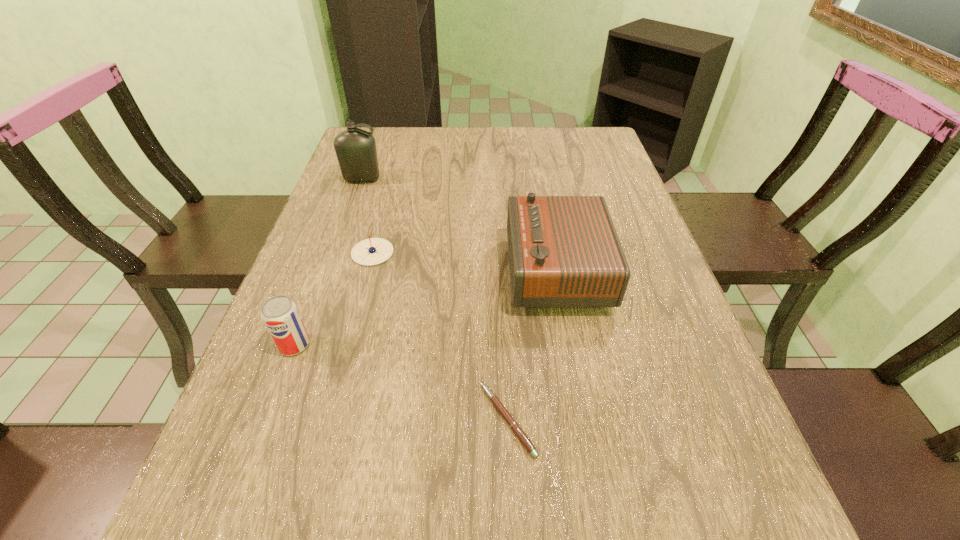
This screenshot has height=540, width=960. I want to click on the tallest object, so click(355, 148).

Identify the location of the farthest object. (355, 148).

Identify the location of radio receiver. (564, 252).

At what (x,y) coordinates should I click in order to perform the action: click on soda. Please return your answer as a coordinate pair (x, y). The image size is (960, 540). Looking at the image, I should click on (279, 313).

Find the location of a particular element. Image resolution: width=960 pixels, height=540 pixels. the third shortest object is located at coordinates (279, 313).

You are a GUI agent. You are given a task and a screenshot of the screen. Output one action in this format:
    pyautogui.click(x=<x>, y=<y>)
    Task: Click on the fourth tallest object
    The height and width of the screenshot is (540, 960).
    Given the screenshot: What is the action you would take?
    pyautogui.click(x=373, y=251)

Identify the location of the shortest object. The width and height of the screenshot is (960, 540). (514, 426).

The width and height of the screenshot is (960, 540). What are the coordinates of `pen` in the screenshot? It's located at (514, 426).

The width and height of the screenshot is (960, 540). Find the location of `vacant space located on the back of the bottle`. vacant space located on the back of the bottle is located at coordinates (379, 131).

I want to click on blank area located on the front panel of the fourth shortest object, so click(x=392, y=271).